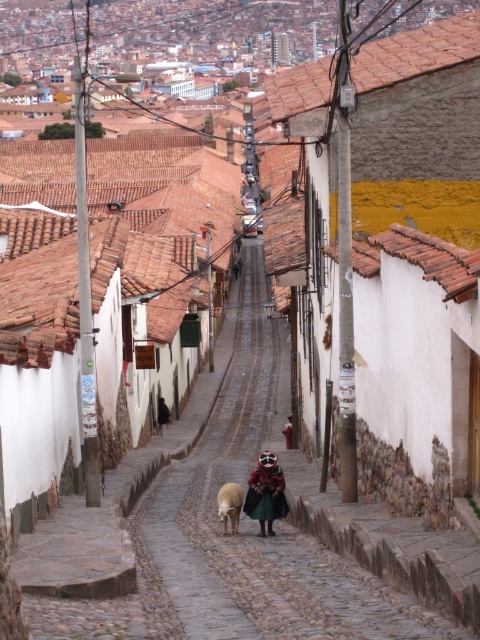
You are a traveler carrying a backpack and want to take a photo of the multicolored woven fabric at center and the white woolen sheep at center. Since the camera has a limited field of view, you need to know which one is larger to adjust your position. Which object is bigger?

The multicolored woven fabric at center is bigger than the white woolen sheep at center, so you should position yourself closer to the white woolen sheep at center to capture both in the frame.

You are a traveler carrying a backpack and want to take a photo of the white woolen sheep at center and the multicolored woven fabric at center. Since the street is narrow, you need to stand on the side where both objects are visible. Which side of the street should you choose?

You should stand on the right side of the street. The multicolored woven fabric at center is to the right of the white woolen sheep at center, so standing on the right side would allow you to see both objects in the frame.